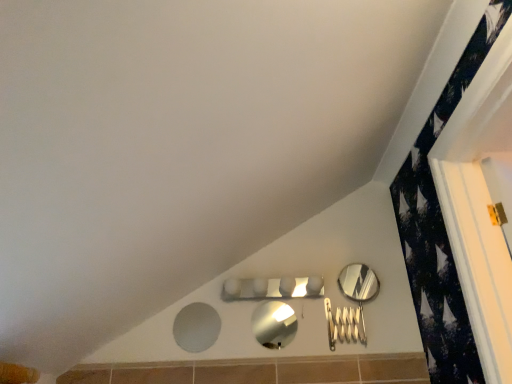
Question: Is metallic silver mirror at center, the second mirror in the right-to-left sequence, taller than polished silver mirror at right, the third mirror in the left-to-right sequence?

Choices:
 (A) no
 (B) yes

Answer: (A)

Question: From a real-world perspective, is metallic silver mirror at center, which is the 2th mirror in left-to-right order, on polished silver mirror at right, the third mirror in the left-to-right sequence?

Choices:
 (A) yes
 (B) no

Answer: (B)

Question: From the image's perspective, is metallic silver mirror at center, the second mirror in the right-to-left sequence, located above polished silver mirror at right, which appears as the 1th mirror when viewed from the right?

Choices:
 (A) no
 (B) yes

Answer: (A)

Question: Is metallic silver mirror at center, which is the 2th mirror in left-to-right order, turned away from polished silver mirror at right, which appears as the 1th mirror when viewed from the right?

Choices:
 (A) yes
 (B) no

Answer: (B)

Question: Does metallic silver mirror at center, the second mirror in the right-to-left sequence, lie behind polished silver mirror at right, which appears as the 1th mirror when viewed from the right?

Choices:
 (A) yes
 (B) no

Answer: (B)

Question: From a real-world perspective, is polished silver mirror at right, which appears as the 1th mirror when viewed from the right, positioned above or below metallic silver mirror at center, the second mirror in the right-to-left sequence?

Choices:
 (A) below
 (B) above

Answer: (B)

Question: Is polished silver mirror at right, which appears as the 1th mirror when viewed from the right, to the left or to the right of metallic silver mirror at center, which is the 2th mirror in left-to-right order, in the image?

Choices:
 (A) left
 (B) right

Answer: (B)

Question: Is polished silver mirror at right, the third mirror in the left-to-right sequence, inside the boundaries of metallic silver mirror at center, which is the 2th mirror in left-to-right order, or outside?

Choices:
 (A) outside
 (B) inside

Answer: (A)

Question: Considering the positions of point (343, 284) and point (257, 334), is point (343, 284) closer or farther from the camera than point (257, 334)?

Choices:
 (A) closer
 (B) farther

Answer: (B)

Question: From the image's perspective, is matte gray mirror at lower center, the 1th mirror positioned from the left, located above or below metallic silver mirror at center, which is the 2th mirror in left-to-right order?

Choices:
 (A) above
 (B) below

Answer: (B)

Question: Is matte gray mirror at lower center, the third mirror positioned from the right, wider or thinner than metallic silver mirror at center, the second mirror in the right-to-left sequence?

Choices:
 (A) wide
 (B) thin

Answer: (B)

Question: Considering the positions of matte gray mirror at lower center, the third mirror positioned from the right, and metallic silver mirror at center, the second mirror in the right-to-left sequence, in the image, is matte gray mirror at lower center, the third mirror positioned from the right, taller or shorter than metallic silver mirror at center, the second mirror in the right-to-left sequence,?

Choices:
 (A) tall
 (B) short

Answer: (A)

Question: Is matte gray mirror at lower center, the third mirror positioned from the right, in front of or behind metallic silver mirror at center, the second mirror in the right-to-left sequence, in the image?

Choices:
 (A) behind
 (B) front

Answer: (A)

Question: Would you say matte gray mirror at lower center, the 1th mirror positioned from the left, is to the left or to the right of polished silver mirror at right, which appears as the 1th mirror when viewed from the right, in the picture?

Choices:
 (A) right
 (B) left

Answer: (B)

Question: Considering the positions of matte gray mirror at lower center, the 1th mirror positioned from the left, and polished silver mirror at right, the third mirror in the left-to-right sequence, in the image, is matte gray mirror at lower center, the 1th mirror positioned from the left, taller or shorter than polished silver mirror at right, the third mirror in the left-to-right sequence,?

Choices:
 (A) tall
 (B) short

Answer: (A)